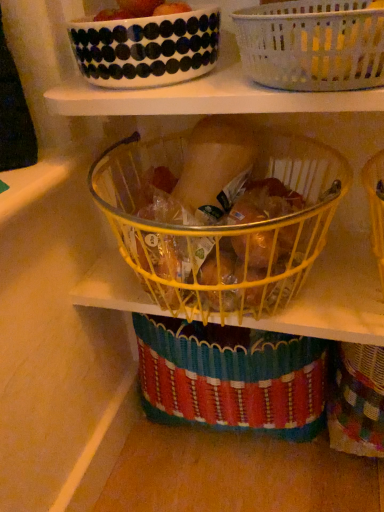
Question: Is yellow wire basket at center, which ranks as the second basket in top-to-bottom order, far away from smooth red tomato at upper center?

Choices:
 (A) no
 (B) yes

Answer: (A)

Question: Considering the relative sizes of yellow wire basket at center, the first basket positioned from the bottom, and smooth red tomato at upper center in the image provided, is yellow wire basket at center, the first basket positioned from the bottom, wider than smooth red tomato at upper center?

Choices:
 (A) no
 (B) yes

Answer: (B)

Question: Can you confirm if yellow wire basket at center, the first basket positioned from the bottom, is shorter than smooth red tomato at upper center?

Choices:
 (A) yes
 (B) no

Answer: (B)

Question: Is yellow wire basket at center, which ranks as the second basket in top-to-bottom order, beside smooth red tomato at upper center?

Choices:
 (A) no
 (B) yes

Answer: (A)

Question: Is yellow wire basket at center, the first basket positioned from the bottom, oriented away from smooth red tomato at upper center?

Choices:
 (A) yes
 (B) no

Answer: (B)

Question: Considering the positions of white glossy bowl at upper center and white woven basket at upper center, which appears as the 1th basket when viewed from the top, in the image, is white glossy bowl at upper center wider or thinner than white woven basket at upper center, which appears as the 1th basket when viewed from the top,?

Choices:
 (A) wide
 (B) thin

Answer: (B)

Question: Considering the positions of white glossy bowl at upper center and white woven basket at upper center, which is the 2th basket in bottom-to-top order, in the image, is white glossy bowl at upper center taller or shorter than white woven basket at upper center, which is the 2th basket in bottom-to-top order,?

Choices:
 (A) short
 (B) tall

Answer: (A)

Question: Is white glossy bowl at upper center bigger or smaller than white woven basket at upper center, which is the 2th basket in bottom-to-top order?

Choices:
 (A) small
 (B) big

Answer: (A)

Question: From the image's perspective, is white glossy bowl at upper center positioned above or below white woven basket at upper center, which is the 2th basket in bottom-to-top order?

Choices:
 (A) below
 (B) above

Answer: (B)

Question: Based on their sizes in the image, would you say white woven basket at upper center, which is the 2th basket in bottom-to-top order, is bigger or smaller than yellow wire basket at center, the first basket positioned from the bottom?

Choices:
 (A) big
 (B) small

Answer: (B)

Question: Considering the relative positions of white woven basket at upper center, which is the 2th basket in bottom-to-top order, and yellow wire basket at center, the first basket positioned from the bottom, in the image provided, is white woven basket at upper center, which is the 2th basket in bottom-to-top order, to the left or to the right of yellow wire basket at center, the first basket positioned from the bottom,?

Choices:
 (A) right
 (B) left

Answer: (A)

Question: Is white woven basket at upper center, which is the 2th basket in bottom-to-top order, situated inside yellow wire basket at center, the first basket positioned from the bottom, or outside?

Choices:
 (A) outside
 (B) inside

Answer: (A)

Question: From the image's perspective, is white woven basket at upper center, which appears as the 1th basket when viewed from the top, above or below yellow wire basket at center, the first basket positioned from the bottom?

Choices:
 (A) above
 (B) below

Answer: (A)

Question: From their relative heights in the image, would you say white glossy bowl at upper center is taller or shorter than smooth red tomato at upper center?

Choices:
 (A) short
 (B) tall

Answer: (B)

Question: Is point (188, 16) positioned closer to the camera than point (139, 15)?

Choices:
 (A) farther
 (B) closer

Answer: (B)